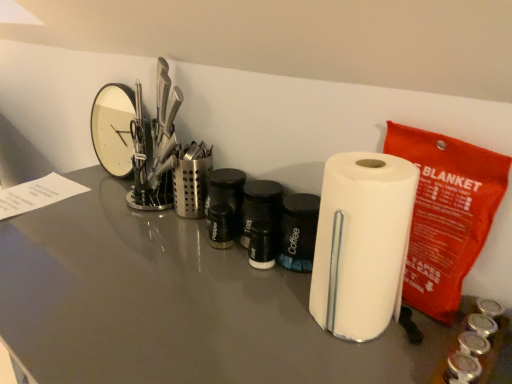
Question: Is white matte paper towel at center completely or partially outside of satin silver utensil holder at center, which is the second stationery in right-to-left order?

Choices:
 (A) yes
 (B) no

Answer: (A)

Question: Is white matte paper towel at center looking in the opposite direction of satin silver utensil holder at center, which is counted as the second stationery, starting from the front?

Choices:
 (A) yes
 (B) no

Answer: (B)

Question: Considering the relative sizes of white matte paper towel at center and satin silver utensil holder at center, the 1th stationery viewed from the left, in the image provided, is white matte paper towel at center wider than satin silver utensil holder at center, the 1th stationery viewed from the left,?

Choices:
 (A) no
 (B) yes

Answer: (B)

Question: Does white matte paper towel at center have a greater height compared to satin silver utensil holder at center, the 1th stationery viewed from the left?

Choices:
 (A) yes
 (B) no

Answer: (A)

Question: Does white matte paper towel at center appear on the right side of satin silver utensil holder at center, which is the second stationery in right-to-left order?

Choices:
 (A) yes
 (B) no

Answer: (A)

Question: Can you confirm if white matte paper towel at center is smaller than satin silver utensil holder at center, which is the second stationery in right-to-left order?

Choices:
 (A) no
 (B) yes

Answer: (A)

Question: Are white glossy paper towel holder at center and white matte paper towel at center far apart?

Choices:
 (A) yes
 (B) no

Answer: (B)

Question: Is white glossy paper towel holder at center to the left of white matte paper towel at center from the viewer's perspective?

Choices:
 (A) no
 (B) yes

Answer: (B)

Question: Is white glossy paper towel holder at center oriented away from white matte paper towel at center?

Choices:
 (A) yes
 (B) no

Answer: (B)

Question: Can you confirm if white glossy paper towel holder at center is wider than white matte paper towel at center?

Choices:
 (A) no
 (B) yes

Answer: (B)

Question: Does white glossy paper towel holder at center appear on the right side of white matte paper towel at center?

Choices:
 (A) no
 (B) yes

Answer: (A)

Question: Considering the relative sizes of white glossy paper towel holder at center and white matte paper towel at center in the image provided, is white glossy paper towel holder at center thinner than white matte paper towel at center?

Choices:
 (A) yes
 (B) no

Answer: (B)

Question: From the image's perspective, is satin silver utensil holder at center, which is the second stationery in right-to-left order, beneath white matte paper towel at center?

Choices:
 (A) no
 (B) yes

Answer: (A)